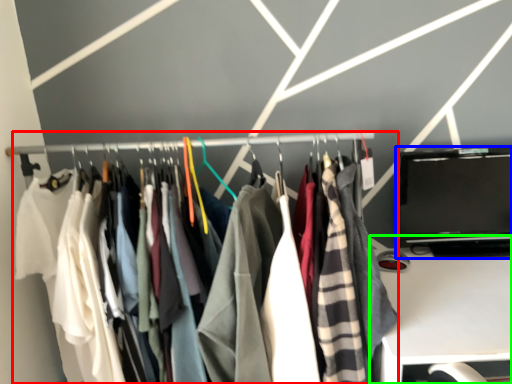
Question: Which is nearer to the closet (highlighted by a red box)? laptop (highlighted by a blue box) or furniture (highlighted by a green box).

Choices:
 (A) laptop
 (B) furniture

Answer: (A)